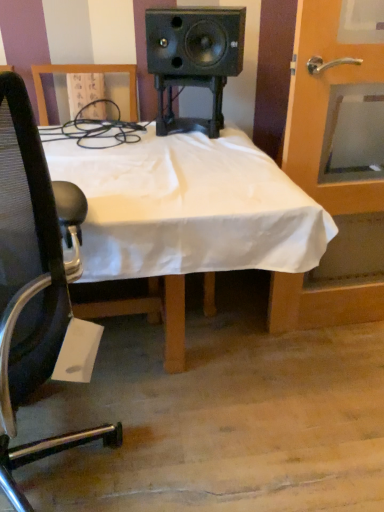
Locate an element on the screen. This screenshot has height=512, width=384. free region under wooden door at right (from a real-world perspective) is located at coordinates (336, 328).